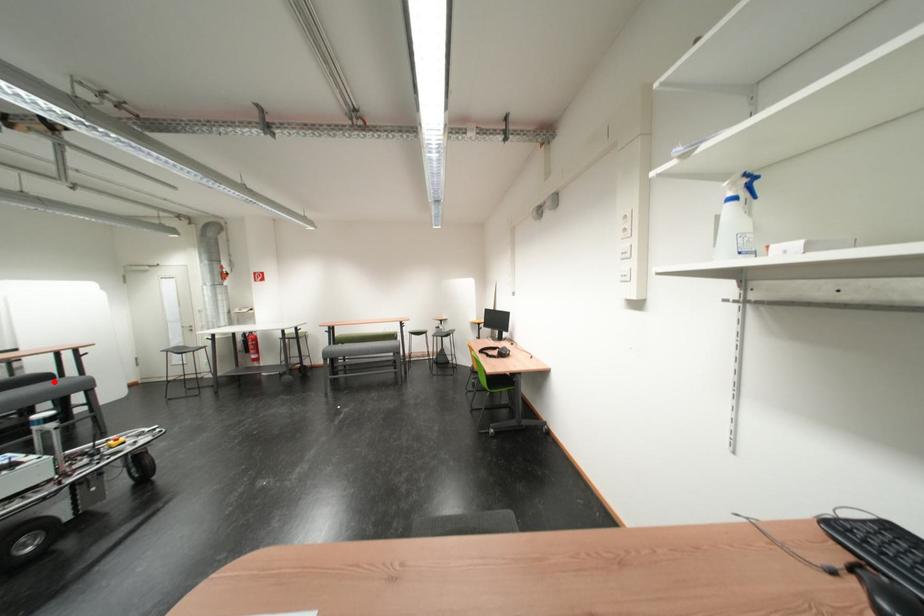
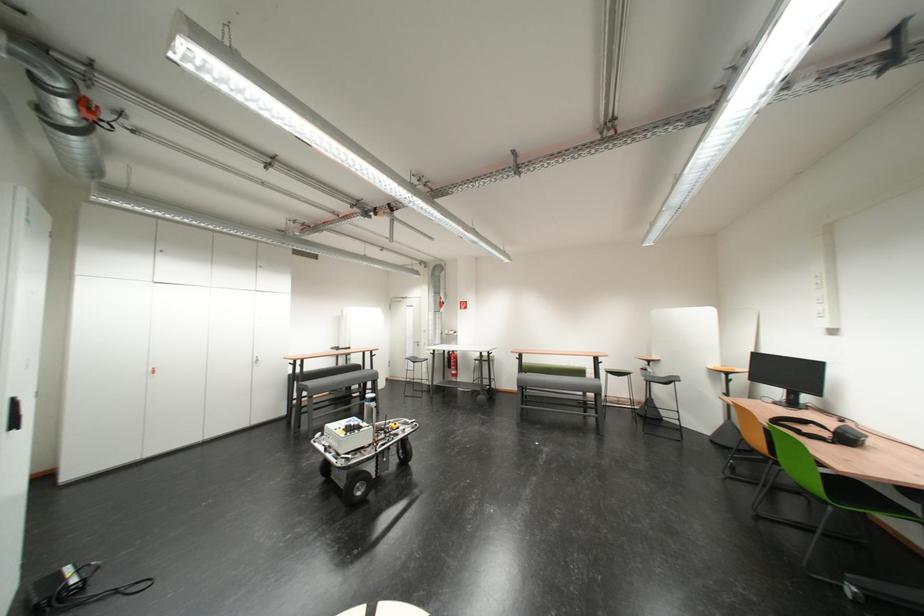
Locate, in the second image, the point that corresponds to the highlighted location in the first image.

(369, 371)